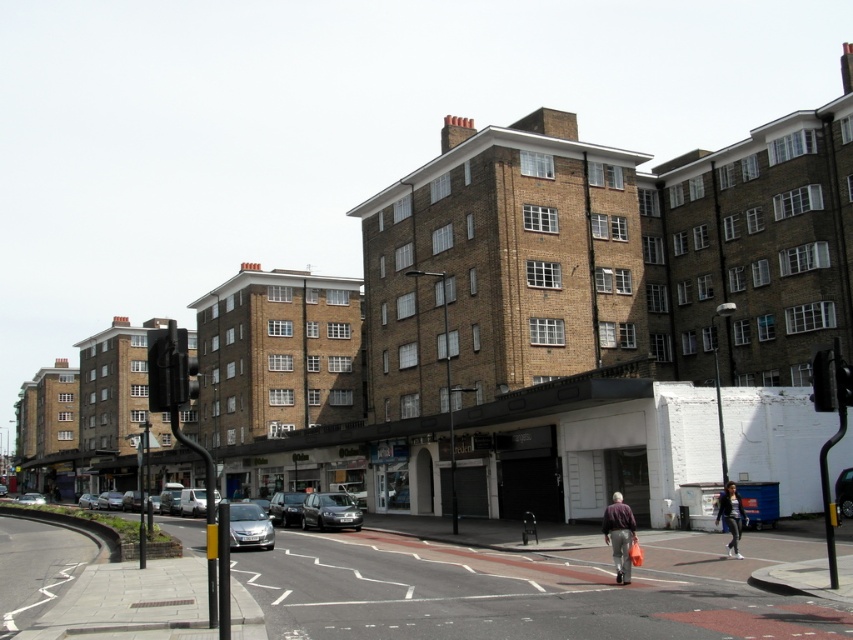
Question: Which point is closer to the camera taking this photo?

Choices:
 (A) (120, 506)
 (B) (96, 499)
 (C) (158, 364)

Answer: (C)

Question: Does black plastic traffic light at right appear over silver metallic van at lower left?

Choices:
 (A) no
 (B) yes

Answer: (B)

Question: Which is nearer to the striped sweater at center?

Choices:
 (A) shiny black car at center
 (B) black plastic traffic light at right

Answer: (B)

Question: Can you confirm if satin silver car at lower center is positioned below black glass traffic light at left?

Choices:
 (A) no
 (B) yes

Answer: (B)

Question: Which object appears closest to the camera in this image?

Choices:
 (A) striped sweater at center
 (B) shiny black car at center

Answer: (A)

Question: Does black matte traffic light at left appear over black plastic traffic light at right?

Choices:
 (A) yes
 (B) no

Answer: (A)